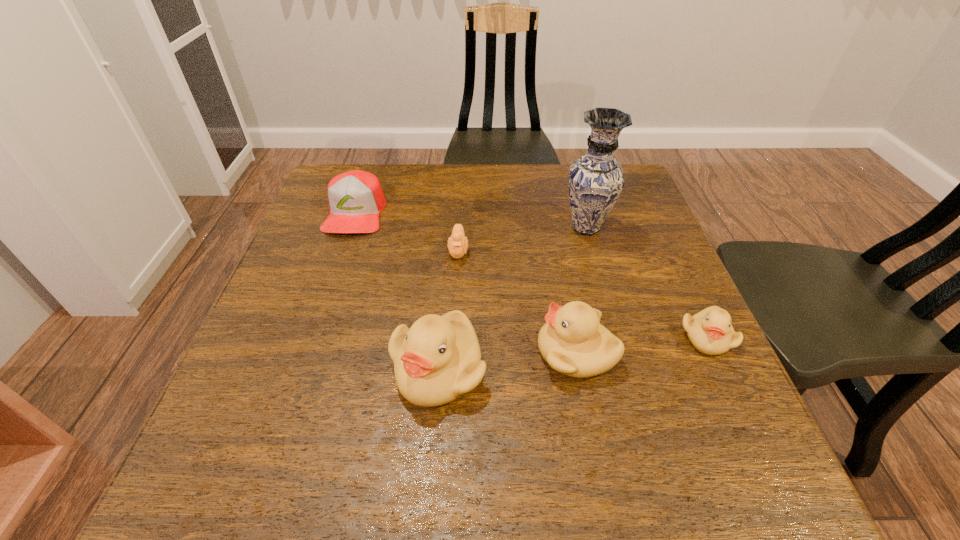
The height and width of the screenshot is (540, 960). Identify the location of vacant position located 0.120m on the beak of the rightmost duckling. (744, 417).

You are a GUI agent. You are given a task and a screenshot of the screen. Output one action in this format:
    pyautogui.click(x=<x>, y=<y>)
    Task: Click on the vacant position located on the front-facing side of the baseball cap
    This screenshot has width=960, height=540.
    Given the screenshot: What is the action you would take?
    pyautogui.click(x=335, y=272)

Identify the location of free region located 0.160m on the front of the vase. (604, 292).

Locate an element on the screen. vacant space located 0.350m on the face of the shortest object is located at coordinates (450, 400).

In order to click on object located in the far edge section of the desktop in this screenshot , I will do `click(356, 198)`.

Identify the location of object that is at the left edge. (356, 198).

The width and height of the screenshot is (960, 540). I want to click on duckling that is positioned at the right edge, so click(710, 331).

Where is `vase located in the right edge section of the desktop`? The image size is (960, 540). vase located in the right edge section of the desktop is located at coordinates (596, 180).

In order to click on object located in the far left corner section of the desktop in this screenshot , I will do pos(356,198).

Locate an element on the screen. The height and width of the screenshot is (540, 960). vacant space at the far edge of the desktop is located at coordinates (395, 172).